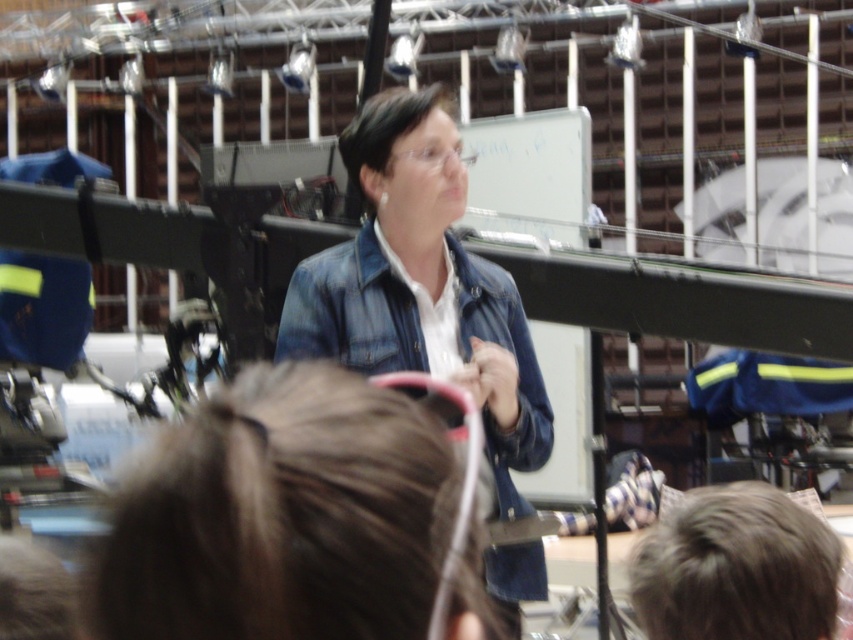
Which of these two, brown straight hair at center or brown matte hair at lower right, stands taller?

With more height is brown straight hair at center.

Does brown straight hair at center have a greater height compared to brown matte hair at lower right?

Yes, brown straight hair at center is taller than brown matte hair at lower right.

Is point (288, 522) positioned after point (659, 536)?

No, it is not.

Locate an element on the screen. brown straight hair at center is located at coordinates [280, 515].

Does brown straight hair at center have a lesser width compared to denim jacket at center?

Yes.

Between point (213, 547) and point (395, 193), which one is positioned in front?

Positioned in front is point (213, 547).

Locate an element on the screen. The height and width of the screenshot is (640, 853). brown straight hair at center is located at coordinates (280, 515).

Is denim jacket at center to the left of brown matte hair at lower right from the viewer's perspective?

Correct, you'll find denim jacket at center to the left of brown matte hair at lower right.

Is denim jacket at center smaller than brown matte hair at lower right?

No.

Which is behind, point (379, 120) or point (697, 518)?

The point (379, 120) is more distant.

What are the coordinates of `denim jacket at center` in the screenshot? It's located at (422, 285).